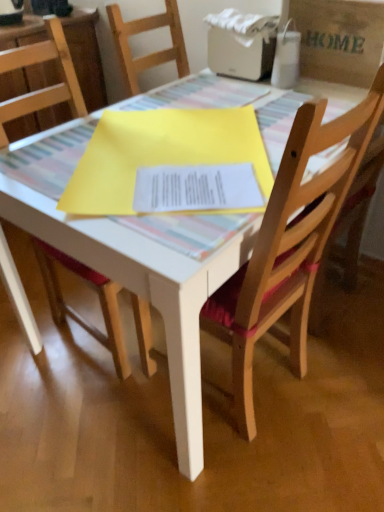
You are a GUI agent. You are given a task and a screenshot of the screen. Output one action in this format:
    pyautogui.click(x=<x>, y=<y>)
    Task: Click on the vacant space positioned to the left of brown paper bag at upper right
    The width and height of the screenshot is (384, 512).
    Given the screenshot: What is the action you would take?
    pyautogui.click(x=272, y=94)